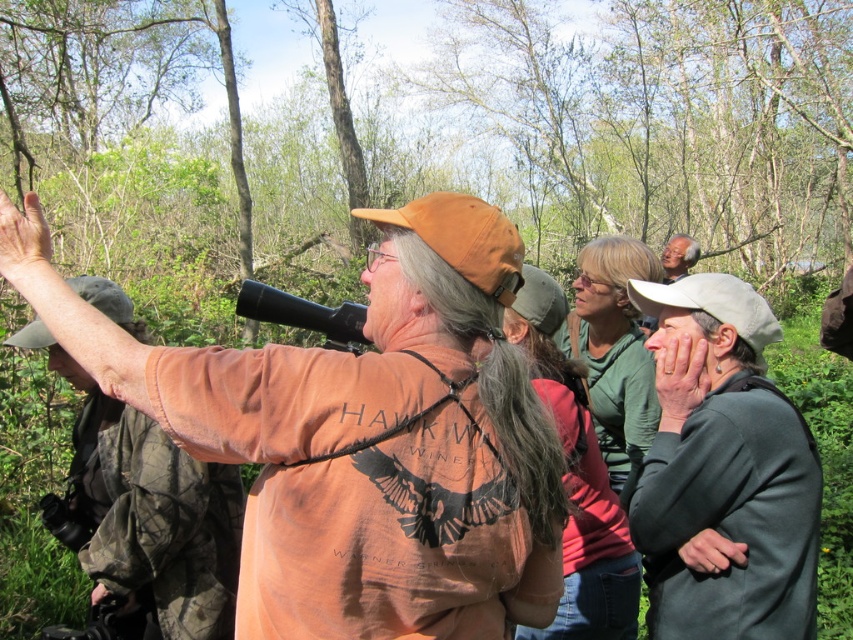
This screenshot has width=853, height=640. What do you see at coordinates (360, 436) in the screenshot?
I see `orange fabric shirt at center` at bounding box center [360, 436].

Which of these two, orange fabric shirt at center or smooth brown hat at upper right, stands taller?

orange fabric shirt at center

Between point (117, 346) and point (672, 244), which one is positioned behind?

Point (672, 244)

I want to click on orange fabric shirt at center, so click(x=360, y=436).

Can you confirm if gray fabric jacket at right is taller than orange fabric shirt at upper left?

In fact, gray fabric jacket at right may be shorter than orange fabric shirt at upper left.

Which is below, gray fabric jacket at right or orange fabric shirt at upper left?

orange fabric shirt at upper left is below.

Image resolution: width=853 pixels, height=640 pixels. I want to click on gray fabric jacket at right, so click(x=724, y=468).

Locate an element on the screen. The image size is (853, 640). gray fabric jacket at right is located at coordinates (724, 468).

Is orange fabric shirt at center wider than gray fabric jacket at right?

Yes.

Is orange fabric shirt at center shorter than gray fabric jacket at right?

Yes.

Measure the distance between point (534, 604) and camera.

Point (534, 604) and camera are 1.57 meters apart.

Where is `orange fabric shirt at center`? The image size is (853, 640). orange fabric shirt at center is located at coordinates (360, 436).